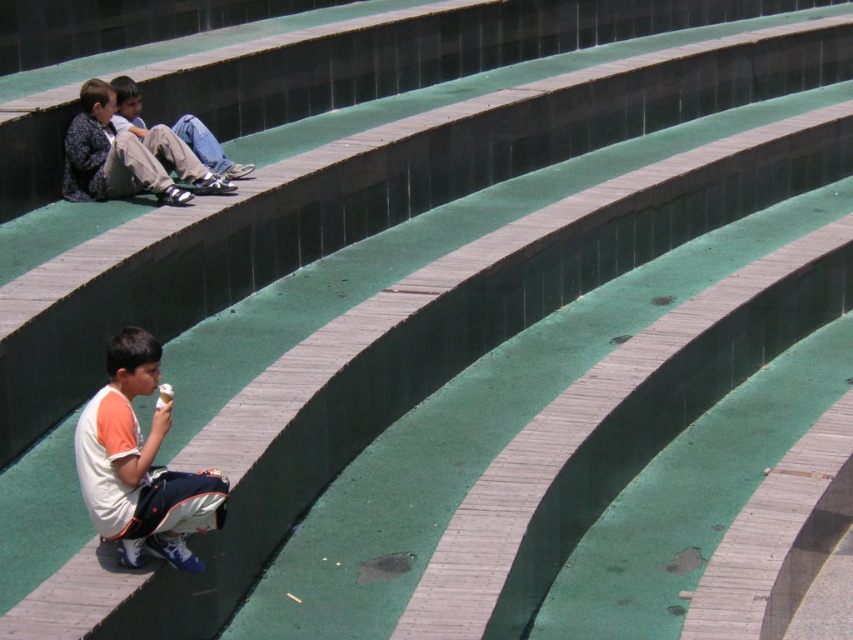
Question: Does white cotton shirt at lower left appear over matte black jacket at upper left?

Choices:
 (A) no
 (B) yes

Answer: (A)

Question: Observing the image, what is the correct spatial positioning of white cotton shirt at lower left in reference to jeans at upper left?

Choices:
 (A) below
 (B) above

Answer: (A)

Question: Which point is closer to the camera taking this photo?

Choices:
 (A) (132, 464)
 (B) (107, 113)

Answer: (A)

Question: Which of these objects is positioned farthest from the jeans at upper left?

Choices:
 (A) matte black jacket at upper left
 (B) white paper ice cream cone at lower left
 (C) white cotton shirt at lower left

Answer: (B)

Question: Can you confirm if white cotton shirt at lower left is positioned to the left of white paper ice cream cone at lower left?

Choices:
 (A) no
 (B) yes

Answer: (B)

Question: Which point is closer to the camera?

Choices:
 (A) jeans at upper left
 (B) white paper ice cream cone at lower left

Answer: (B)